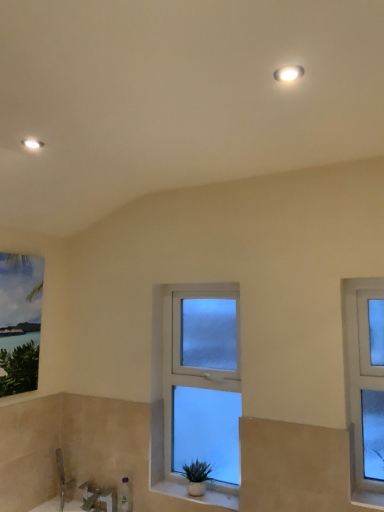
Question: Does white glossy light fixture at upper center, the 1th light fixture positioned from the right, have a lesser height compared to clear glass window at right, acting as the first window starting from the right?

Choices:
 (A) yes
 (B) no

Answer: (A)

Question: Is white glossy light fixture at upper center, the 1th light fixture positioned from the right, positioned with its back to clear glass window at right, acting as the first window starting from the right?

Choices:
 (A) no
 (B) yes

Answer: (A)

Question: Is white glossy light fixture at upper center, positioned as the 1th light fixture in top-to-bottom order, far from clear glass window at right, which is the 2th window in left-to-right order?

Choices:
 (A) yes
 (B) no

Answer: (A)

Question: Considering the relative sizes of white glossy light fixture at upper center, the 2th light fixture positioned from the left, and clear glass window at right, which is counted as the second window, starting from the back, in the image provided, is white glossy light fixture at upper center, the 2th light fixture positioned from the left, thinner than clear glass window at right, which is counted as the second window, starting from the back,?

Choices:
 (A) yes
 (B) no

Answer: (B)

Question: Is the surface of white glossy light fixture at upper center, positioned as the 1th light fixture in top-to-bottom order, in direct contact with clear glass window at right, which is the 2th window in left-to-right order?

Choices:
 (A) yes
 (B) no

Answer: (B)

Question: In the image, is matte white recessed light at upper left, which appears as the first light fixture when viewed from the back, positioned in front of or behind green matte plant at center?

Choices:
 (A) behind
 (B) front

Answer: (B)

Question: Is matte white recessed light at upper left, arranged as the first light fixture when viewed from the left, wider or thinner than green matte plant at center?

Choices:
 (A) wide
 (B) thin

Answer: (B)

Question: Based on their sizes in the image, would you say matte white recessed light at upper left, arranged as the first light fixture when viewed from the left, is bigger or smaller than green matte plant at center?

Choices:
 (A) big
 (B) small

Answer: (B)

Question: Would you say matte white recessed light at upper left, which appears as the first light fixture when viewed from the back, is to the left or to the right of green matte plant at center in the picture?

Choices:
 (A) right
 (B) left

Answer: (B)

Question: From a real-world perspective, is green matte plant at center positioned above or below white ceramic window sill at center?

Choices:
 (A) above
 (B) below

Answer: (A)

Question: Is point (198, 490) positioned closer to the camera than point (196, 500)?

Choices:
 (A) farther
 (B) closer

Answer: (A)

Question: In the image, is green matte plant at center positioned in front of or behind white ceramic window sill at center?

Choices:
 (A) behind
 (B) front

Answer: (A)

Question: From the image's perspective, relative to white ceramic window sill at center, is green matte plant at center above or below?

Choices:
 (A) below
 (B) above

Answer: (B)

Question: Is green matte plant at center taller or shorter than clear glass window at center, acting as the first window starting from the back?

Choices:
 (A) short
 (B) tall

Answer: (A)

Question: Considering their positions, is green matte plant at center located in front of or behind clear glass window at center, acting as the first window starting from the back?

Choices:
 (A) behind
 (B) front

Answer: (B)